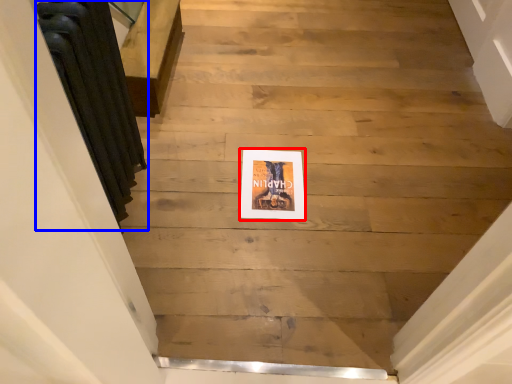
Question: Which point is closer to the camera, picture frame (highlighted by a red box) or radiator (highlighted by a blue box)?

Choices:
 (A) picture frame
 (B) radiator

Answer: (B)